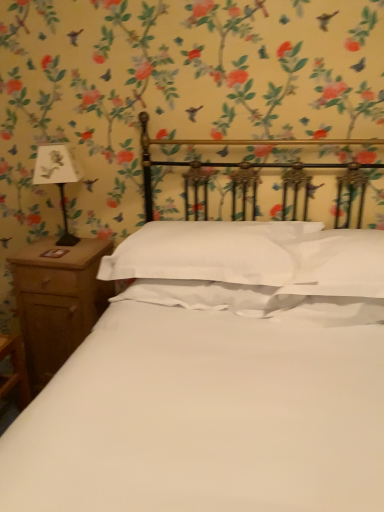
The image size is (384, 512). In order to click on vacant point above brown wood nightstand at left (from a real-world perspective) in this screenshot , I will do `click(64, 252)`.